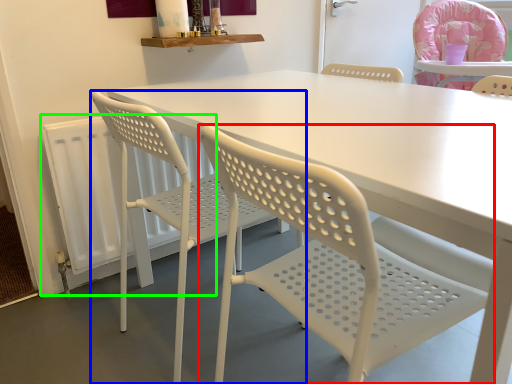
Question: Which object is the closest to the chair (highlighted by a red box)? Choose among these: chair (highlighted by a blue box) or radiator (highlighted by a green box).

Choices:
 (A) chair
 (B) radiator

Answer: (A)